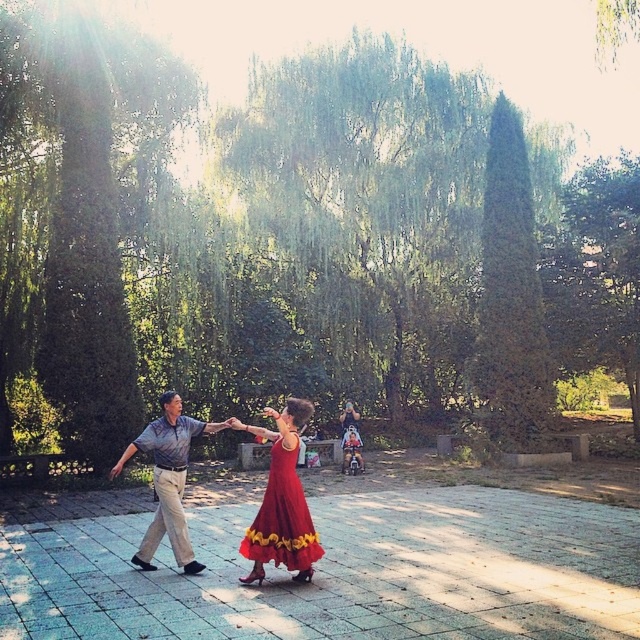
Question: Which point is closer to the camera?

Choices:
 (A) (152, 428)
 (B) (248, 540)

Answer: (B)

Question: Observing the image, what is the correct spatial positioning of shiny red dress at center in reference to gray cotton shirt at center?

Choices:
 (A) below
 (B) above

Answer: (A)

Question: Is shiny red dress at center further to camera compared to gray cotton shirt at center?

Choices:
 (A) yes
 (B) no

Answer: (B)

Question: Among these points, which one is nearest to the camera?

Choices:
 (A) (275, 536)
 (B) (147, 531)

Answer: (A)

Question: Is shiny red dress at center positioned before gray cotton shirt at center?

Choices:
 (A) no
 (B) yes

Answer: (B)

Question: Which of the following is the closest to the observer?

Choices:
 (A) (189, 570)
 (B) (298, 400)

Answer: (A)